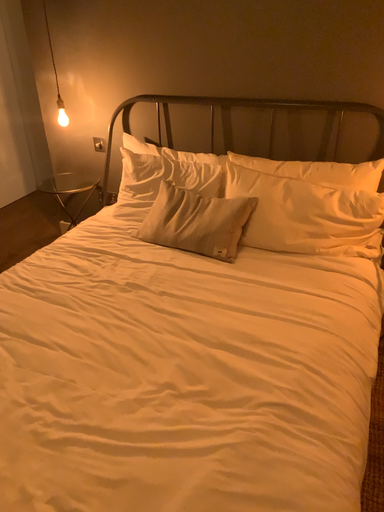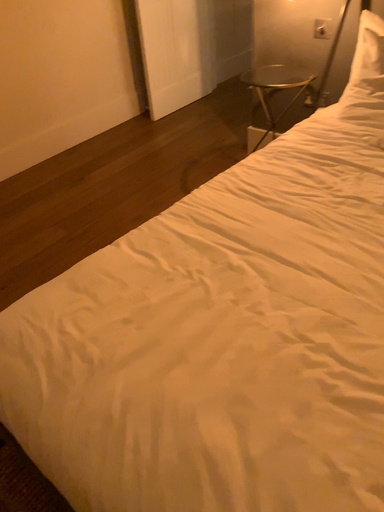
Question: How did the camera likely rotate when shooting the video?

Choices:
 (A) rotated downward
 (B) rotated upward

Answer: (A)